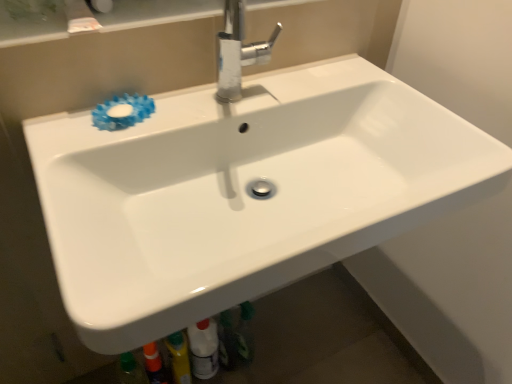
I want to click on free space to the right of white glossy bottle at lower center, so click(267, 357).